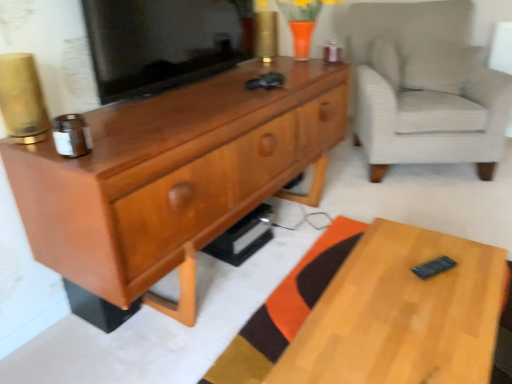
Question: From a real-world perspective, is matte black tv at center physically below matte wood cabinet at center?

Choices:
 (A) yes
 (B) no

Answer: (B)

Question: Is matte black tv at center oriented towards matte wood cabinet at center?

Choices:
 (A) no
 (B) yes

Answer: (A)

Question: Is matte black tv at center at the left side of matte wood cabinet at center?

Choices:
 (A) yes
 (B) no

Answer: (A)

Question: Can matte wood cabinet at center be found inside matte black tv at center?

Choices:
 (A) no
 (B) yes

Answer: (A)

Question: Does matte black tv at center have a lesser width compared to matte wood cabinet at center?

Choices:
 (A) yes
 (B) no

Answer: (A)

Question: Is matte wood cabinet at center at the back of matte black tv at center?

Choices:
 (A) yes
 (B) no

Answer: (B)

Question: Is matte black tv at center at the right side of light wood desk at lower right?

Choices:
 (A) yes
 (B) no

Answer: (B)

Question: Is matte black tv at center aimed at light wood desk at lower right?

Choices:
 (A) no
 (B) yes

Answer: (A)

Question: Can you confirm if matte black tv at center is taller than light wood desk at lower right?

Choices:
 (A) no
 (B) yes

Answer: (B)

Question: Can light wood desk at lower right be found inside matte black tv at center?

Choices:
 (A) yes
 (B) no

Answer: (B)

Question: Are matte black tv at center and light wood desk at lower right located far from each other?

Choices:
 (A) no
 (B) yes

Answer: (B)

Question: Does matte black tv at center appear on the left side of light wood desk at lower right?

Choices:
 (A) yes
 (B) no

Answer: (A)

Question: Is matte black tv at center positioned beyond the bounds of light gray textured armchair at right?

Choices:
 (A) no
 (B) yes

Answer: (B)